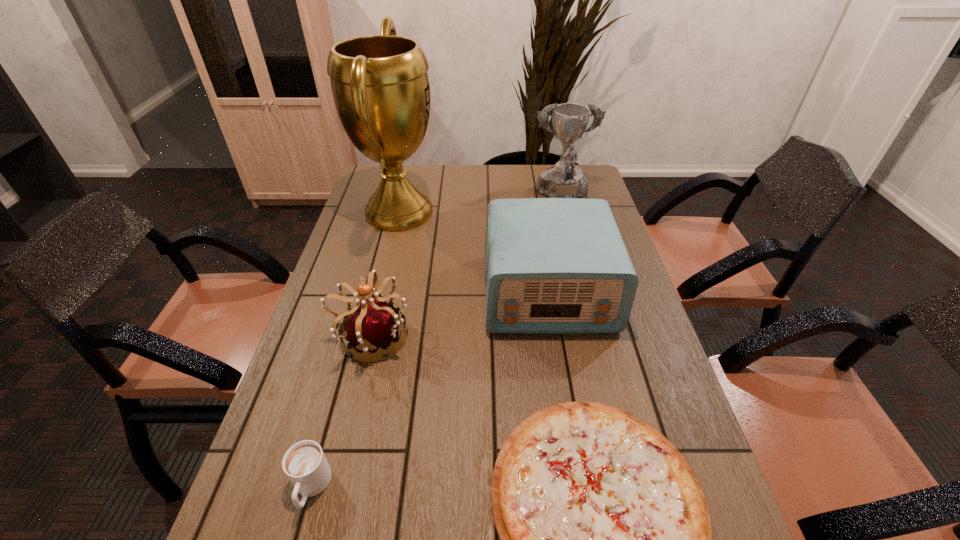
In the image, there is a desktop. Where is `vacant space at the right edge`? Image resolution: width=960 pixels, height=540 pixels. vacant space at the right edge is located at coordinates (660, 404).

This screenshot has height=540, width=960. What are the coordinates of `vacant space that's between the trophy cup and the tiara` in the screenshot? It's located at (385, 274).

At what (x,y) coordinates should I click in order to perform the action: click on free spot between the cappuccino and the tiara. Please return your answer as a coordinate pair (x, y). The height and width of the screenshot is (540, 960). Looking at the image, I should click on [341, 412].

I want to click on free space between the fifth tallest object and the tallest object, so click(x=355, y=350).

What are the coordinates of `vacant area that lies between the tiara and the tallest object` in the screenshot? It's located at tap(385, 274).

Where is `free space between the cappuccino and the second tallest object`? This screenshot has width=960, height=540. free space between the cappuccino and the second tallest object is located at coordinates (437, 342).

The width and height of the screenshot is (960, 540). Find the location of `vacant area between the tiara and the tallest object`. vacant area between the tiara and the tallest object is located at coordinates (385, 274).

This screenshot has width=960, height=540. Find the location of `the fourth closest object to the radio receiver`. the fourth closest object to the radio receiver is located at coordinates (563, 180).

Choose which object is the nearest neighbor to the radio receiver. Please provide its 2D coordinates. Your answer should be formatted as a tuple, i.e. [(x, y)], where the tuple contains the x and y coordinates of a point satisfying the conditions above.

[(380, 85)]

I want to click on vacant area in the image that satisfies the following two spatial constraints: 1. on the front-facing side of the tiara; 2. on the side with the handle of the fifth tallest object, so click(335, 488).